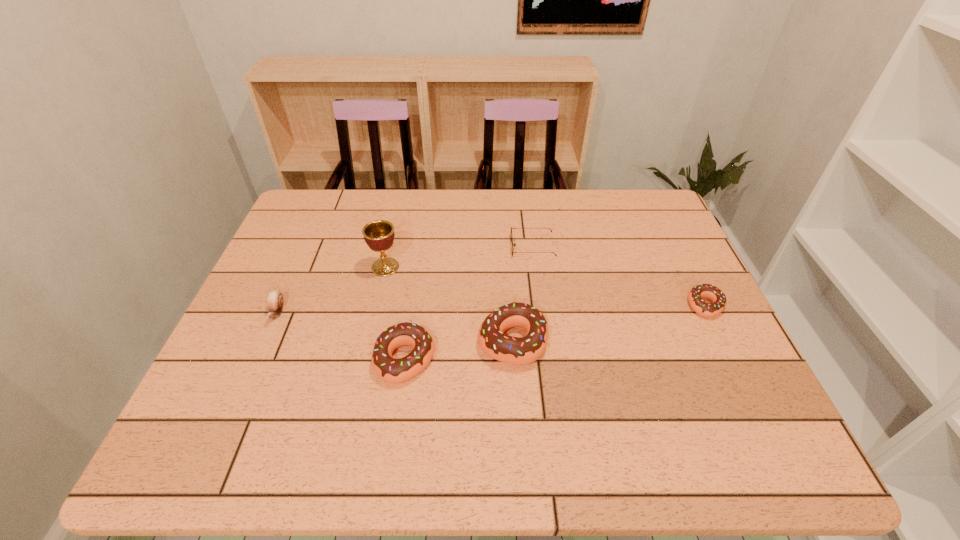
Locate an element on the screen. Image resolution: width=960 pixels, height=540 pixels. vacant space that is in between the second shortest doughnut and the chalice is located at coordinates (396, 314).

Identify the location of free spot between the leftmost doughnut and the chalice. This screenshot has width=960, height=540. (396, 314).

I want to click on vacant space that is in between the sunglasses and the fourth tallest object, so click(x=405, y=280).

Locate which object ranks in proximity to the second shortest doughnut. Please provide its 2D coordinates. Your answer should be formatted as a tuple, i.e. [(x, y)], where the tuple contains the x and y coordinates of a point satisfying the conditions above.

[(514, 350)]

This screenshot has width=960, height=540. Find the location of `object that is the second closest to the rightmost object`. object that is the second closest to the rightmost object is located at coordinates (514, 350).

Locate which doughnut is the closest to the rightmost object. Please provide its 2D coordinates. Your answer should be formatted as a tuple, i.e. [(x, y)], where the tuple contains the x and y coordinates of a point satisfying the conditions above.

[(514, 350)]

Identify which doughnut is the second nearest to the sunglasses. Please provide its 2D coordinates. Your answer should be formatted as a tuple, i.e. [(x, y)], where the tuple contains the x and y coordinates of a point satisfying the conditions above.

[(391, 370)]

The width and height of the screenshot is (960, 540). Find the location of `blank area in the image that satisfies the following two spatial constraints: 1. on the back side of the rightmost doughnut; 2. on the front-facing side of the sunglasses`. blank area in the image that satisfies the following two spatial constraints: 1. on the back side of the rightmost doughnut; 2. on the front-facing side of the sunglasses is located at coordinates (677, 247).

Identify the location of vacant space that satisfies the following two spatial constraints: 1. on the front side of the chalice; 2. on the right side of the second doughnut from left to right. This screenshot has height=540, width=960. (369, 340).

This screenshot has height=540, width=960. I want to click on free space that satisfies the following two spatial constraints: 1. on the front side of the tallest object; 2. on the right side of the second doughnut from right to left, so click(x=369, y=340).